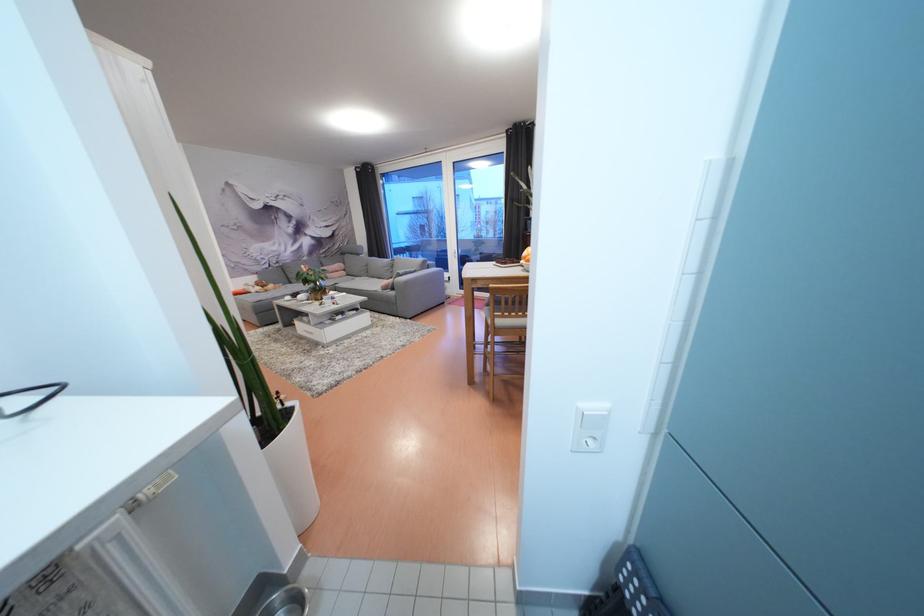
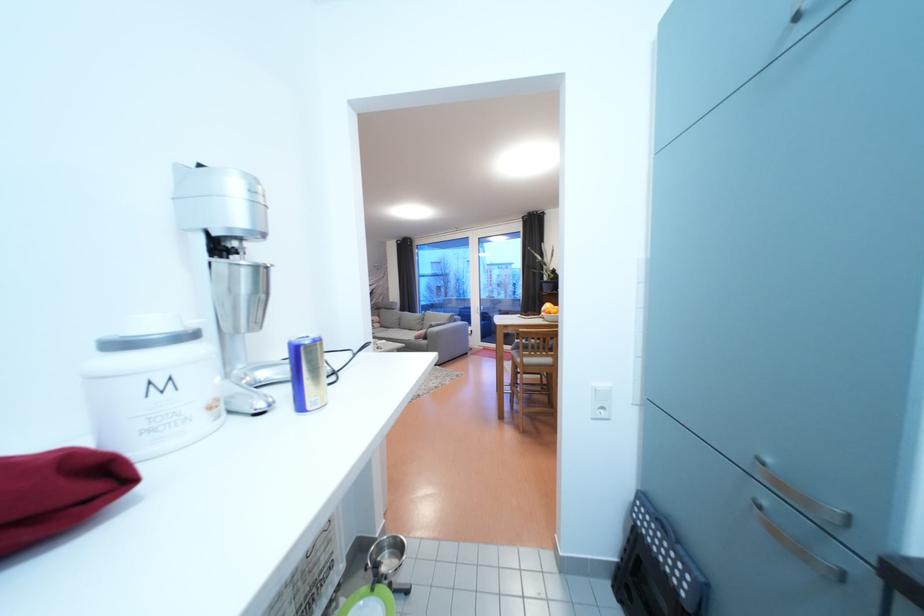
Where in the second image is the point corresponding to the point at 598,447 from the first image?

(610, 416)